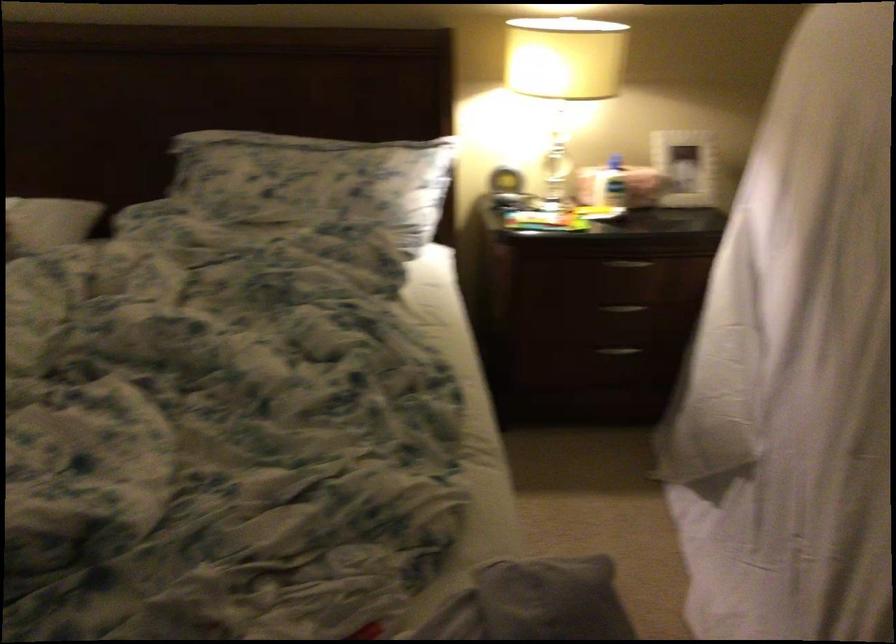
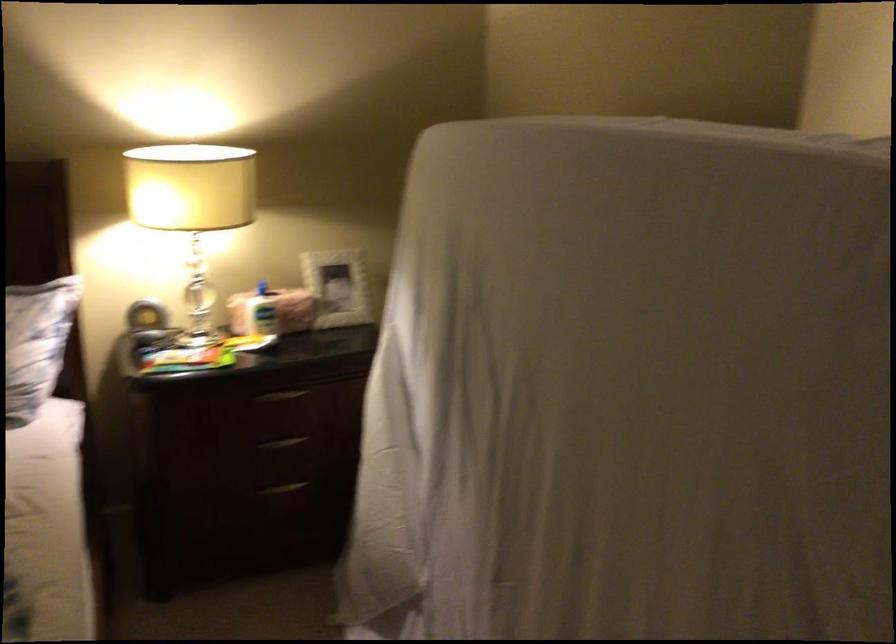
Where in the second image is the point corresponding to point 686,161 from the first image?

(337, 287)